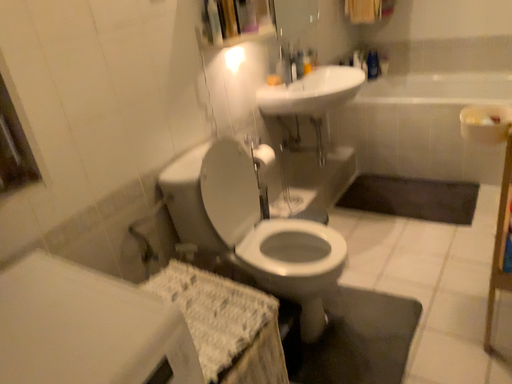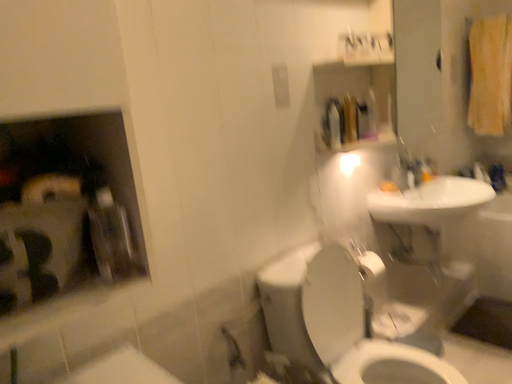
Question: How did the camera likely rotate when shooting the video?

Choices:
 (A) rotated right
 (B) rotated left

Answer: (B)